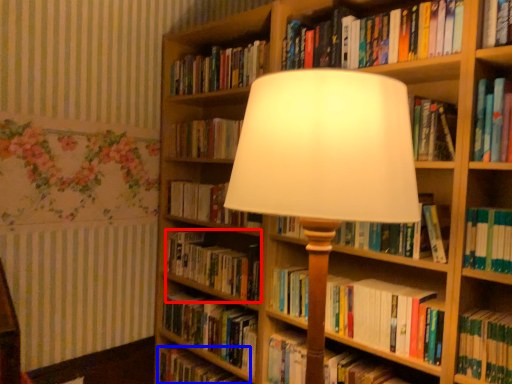
Question: Which point is further to the camera, book (highlighted by a red box) or book (highlighted by a blue box)?

Choices:
 (A) book
 (B) book

Answer: (B)